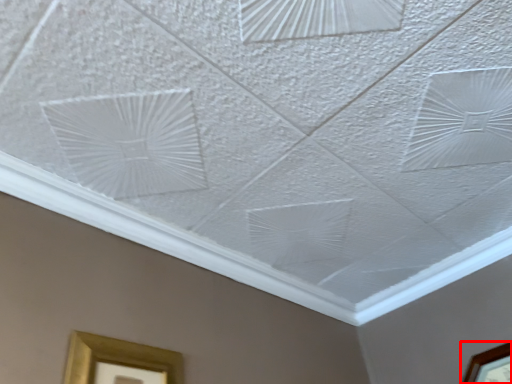
Question: Where is picture frame (annotated by the red box) located in relation to picture frame in the image?

Choices:
 (A) right
 (B) left

Answer: (A)